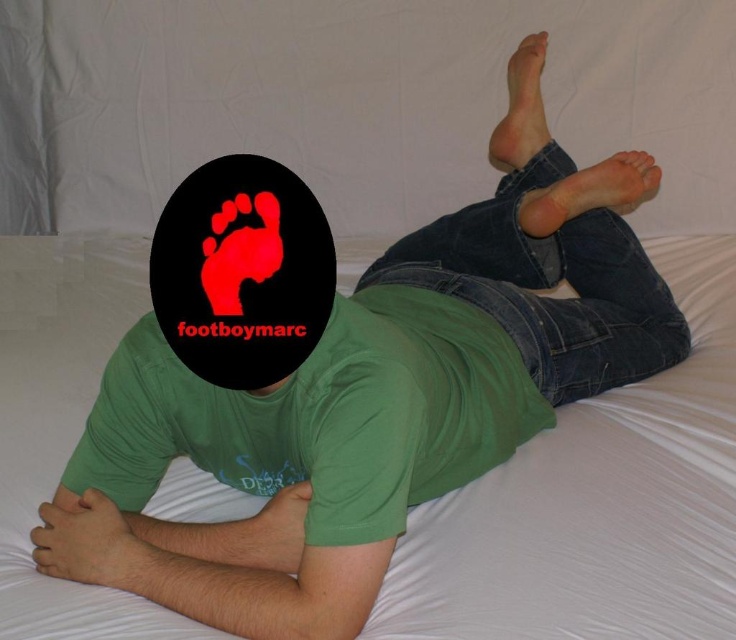
Question: Does smooth skin hand at lower left appear on the left side of matte green t-shirt at lower center?

Choices:
 (A) yes
 (B) no

Answer: (A)

Question: Does smooth skin hand at lower left appear on the right side of matte green t-shirt at lower center?

Choices:
 (A) no
 (B) yes

Answer: (A)

Question: Which point appears closest to the camera in this image?

Choices:
 (A) (265, 564)
 (B) (92, 579)

Answer: (B)

Question: Among these objects, which one is nearest to the camera?

Choices:
 (A) smooth skin hand at lower left
 (B) matte green t-shirt at lower center

Answer: (A)

Question: Does smooth skin hand at lower left have a larger size compared to matte green t-shirt at lower center?

Choices:
 (A) yes
 (B) no

Answer: (A)

Question: Which of the following is the farthest from the observer?

Choices:
 (A) smooth skin hand at lower left
 (B) matte green t-shirt at lower center

Answer: (B)